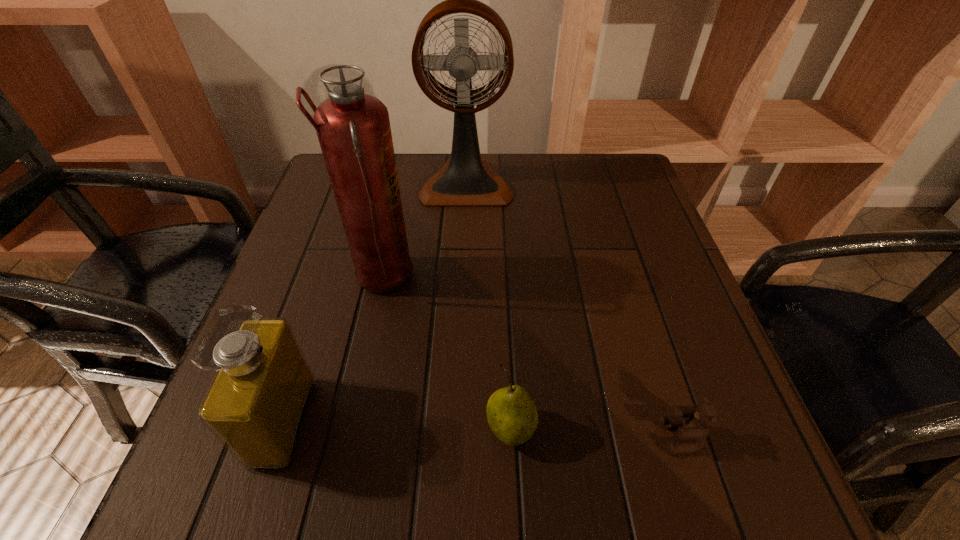
Where is `vacant area that satisfies the following two spatial constraints: 1. on the front-facing side of the fan; 2. on the side of the second farthest object with the label`? This screenshot has height=540, width=960. vacant area that satisfies the following two spatial constraints: 1. on the front-facing side of the fan; 2. on the side of the second farthest object with the label is located at coordinates (463, 279).

The image size is (960, 540). Find the location of `vacant space that satisfies the following two spatial constraints: 1. on the front-facing side of the fan; 2. on the side of the fourth nearest object with the label`. vacant space that satisfies the following two spatial constraints: 1. on the front-facing side of the fan; 2. on the side of the fourth nearest object with the label is located at coordinates 463,279.

The height and width of the screenshot is (540, 960). I want to click on free space that satisfies the following two spatial constraints: 1. on the side of the fire extinguisher with the label; 2. on the back side of the pear, so [x=348, y=429].

At what (x,y) coordinates should I click in order to perform the action: click on free location that satisfies the following two spatial constraints: 1. on the front-facing side of the leftmost object; 2. on the left side of the fourth tallest object. Please return your answer as a coordinate pair (x, y). The height and width of the screenshot is (540, 960). Looking at the image, I should click on (282, 429).

Find the location of `vacant point that satisfies the following two spatial constraints: 1. on the front-facing side of the second shortest object; 2. on the right side of the farthest object`. vacant point that satisfies the following two spatial constraints: 1. on the front-facing side of the second shortest object; 2. on the right side of the farthest object is located at coordinates (457, 429).

The image size is (960, 540). Identify the location of vacant space that satisfies the following two spatial constraints: 1. on the front-facing side of the fan; 2. on the side of the fourth nearest object with the label. (463, 279).

Image resolution: width=960 pixels, height=540 pixels. Find the location of `free point that satisfies the following two spatial constraints: 1. on the front-facing side of the farthest object; 2. on the side of the fire extinguisher with the label`. free point that satisfies the following two spatial constraints: 1. on the front-facing side of the farthest object; 2. on the side of the fire extinguisher with the label is located at coordinates [463, 279].

Locate an element on the screen. This screenshot has width=960, height=540. free space in the image that satisfies the following two spatial constraints: 1. on the front-facing side of the farthest object; 2. on the front-facing side of the perfume is located at coordinates (457, 421).